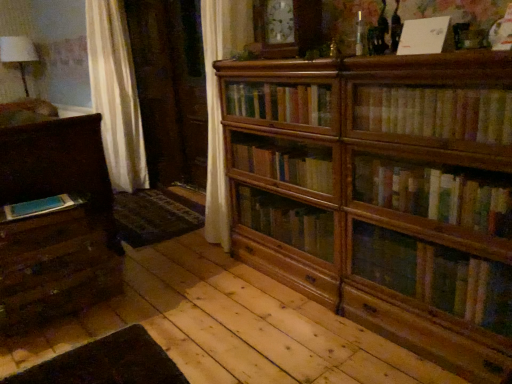
Question: Does white paper at upper center, the second book when ordered from left to right, have a greater width compared to wooden drawer at lower left, which is the first drawer in top-to-bottom order?

Choices:
 (A) no
 (B) yes

Answer: (A)

Question: Could wooden drawer at lower left, which is the first drawer in top-to-bottom order, be considered to be inside white paper at upper center, which is the second book from right to left?

Choices:
 (A) yes
 (B) no

Answer: (B)

Question: Is white paper at upper center, which ranks as the second book in back-to-front order, outside of wooden drawer at lower left, which is the first drawer in top-to-bottom order?

Choices:
 (A) no
 (B) yes

Answer: (B)

Question: Is white paper at upper center, the 2th book viewed from the front, closer to the viewer compared to wooden drawer at lower left, which is the first drawer in top-to-bottom order?

Choices:
 (A) yes
 (B) no

Answer: (A)

Question: Is white paper at upper center, positioned as the first book in top-to-bottom order, behind wooden drawer at lower left, placed as the second drawer when sorted from bottom to top?

Choices:
 (A) no
 (B) yes

Answer: (A)

Question: Is wooden bookcase at center situated inside wooden drawer at lower left, placed as the second drawer when sorted from bottom to top, or outside?

Choices:
 (A) outside
 (B) inside

Answer: (A)

Question: Based on their sizes in the image, would you say wooden bookcase at center is bigger or smaller than wooden drawer at lower left, which is the first drawer in top-to-bottom order?

Choices:
 (A) small
 (B) big

Answer: (B)

Question: From the image's perspective, relative to wooden drawer at lower left, placed as the second drawer when sorted from bottom to top, is wooden bookcase at center above or below?

Choices:
 (A) below
 (B) above

Answer: (B)

Question: Considering the positions of wooden bookcase at center and wooden drawer at lower left, which is the first drawer in top-to-bottom order, in the image, is wooden bookcase at center wider or thinner than wooden drawer at lower left, which is the first drawer in top-to-bottom order,?

Choices:
 (A) wide
 (B) thin

Answer: (B)

Question: In terms of width, does yellowish paperbacks at upper right, the 3th book when ordered from left to right, look wider or thinner when compared to wooden bookcase at center?

Choices:
 (A) wide
 (B) thin

Answer: (B)

Question: From their relative heights in the image, would you say yellowish paperbacks at upper right, the 1th book viewed from the right, is taller or shorter than wooden bookcase at center?

Choices:
 (A) tall
 (B) short

Answer: (B)

Question: Considering the positions of yellowish paperbacks at upper right, the 3th book when ordered from left to right, and wooden bookcase at center in the image, is yellowish paperbacks at upper right, the 3th book when ordered from left to right, bigger or smaller than wooden bookcase at center?

Choices:
 (A) small
 (B) big

Answer: (A)

Question: From the image's perspective, is yellowish paperbacks at upper right, the first book when ordered from front to back, located above or below wooden bookcase at center?

Choices:
 (A) above
 (B) below

Answer: (A)

Question: Relative to wooden drawer at lower left, arranged as the 2th drawer when viewed from the top, is wooden bookcase at center in front or behind?

Choices:
 (A) front
 (B) behind

Answer: (A)

Question: In terms of width, does wooden bookcase at center look wider or thinner when compared to wooden drawer at lower left, arranged as the 2th drawer when viewed from the top?

Choices:
 (A) wide
 (B) thin

Answer: (B)